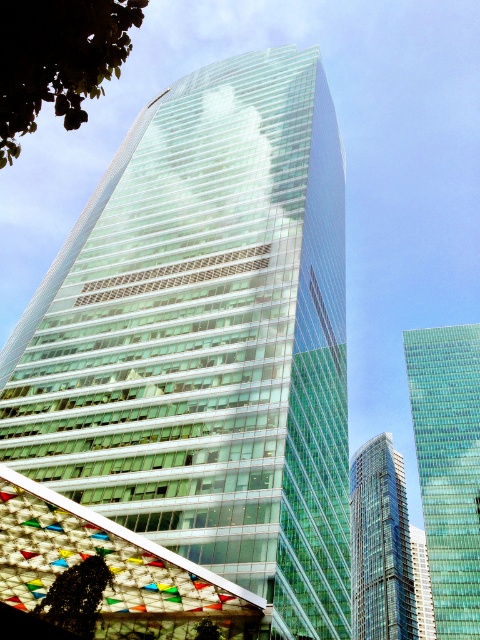
Which is in front, point (140, 460) or point (384, 630)?

Point (140, 460)

Identify the location of transparent glass building at center. This screenshot has height=640, width=480. (205, 339).

Does transparent glass skyscraper at upper center lie behind green leafy tree at lower center?

Yes, transparent glass skyscraper at upper center is behind green leafy tree at lower center.

Is transparent glass skyscraper at upper center below green leafy tree at lower center?

Correct, transparent glass skyscraper at upper center is located below green leafy tree at lower center.

The image size is (480, 640). I want to click on transparent glass skyscraper at upper center, so click(x=448, y=467).

Which is more to the right, transparent glass building at center or green leafy tree at upper left?

green leafy tree at upper left

Is transparent glass building at center thinner than green leafy tree at upper left?

No, transparent glass building at center is not thinner than green leafy tree at upper left.

Between point (48, 481) and point (73, 36), which one is positioned behind?

Positioned behind is point (48, 481).

This screenshot has width=480, height=640. What are the coordinates of `transparent glass building at center` in the screenshot? It's located at (205, 339).